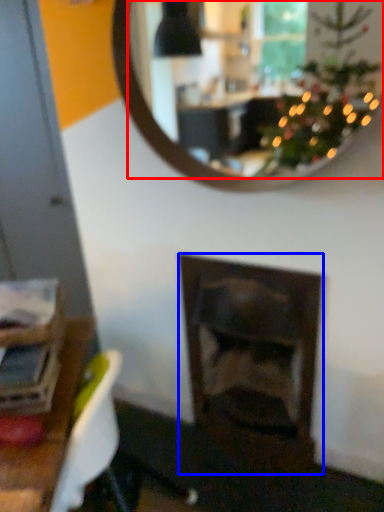
Question: Which of the following is the farthest to the observer, mirror (highlighted by a red box) or fireplace (highlighted by a blue box)?

Choices:
 (A) mirror
 (B) fireplace

Answer: (B)